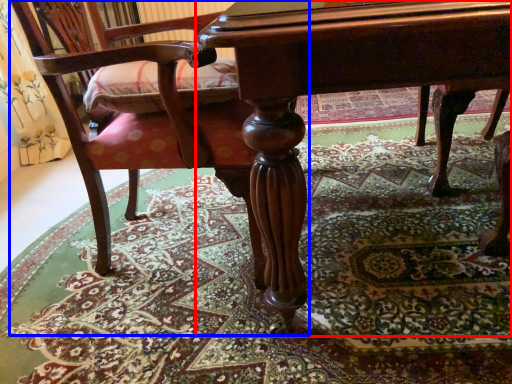
Question: Which object appears closest to the camera in this image, table (highlighted by a red box) or chair (highlighted by a blue box)?

Choices:
 (A) table
 (B) chair

Answer: (A)